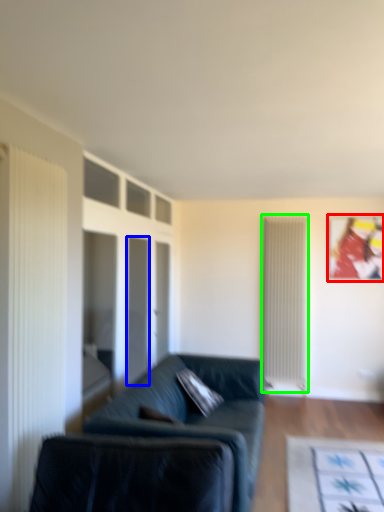
Question: Based on their relative distances, which object is farther from picture frame (highlighted by a red box)? Choose from glass door (highlighted by a blue box) and radiator (highlighted by a green box).

Choices:
 (A) glass door
 (B) radiator

Answer: (A)